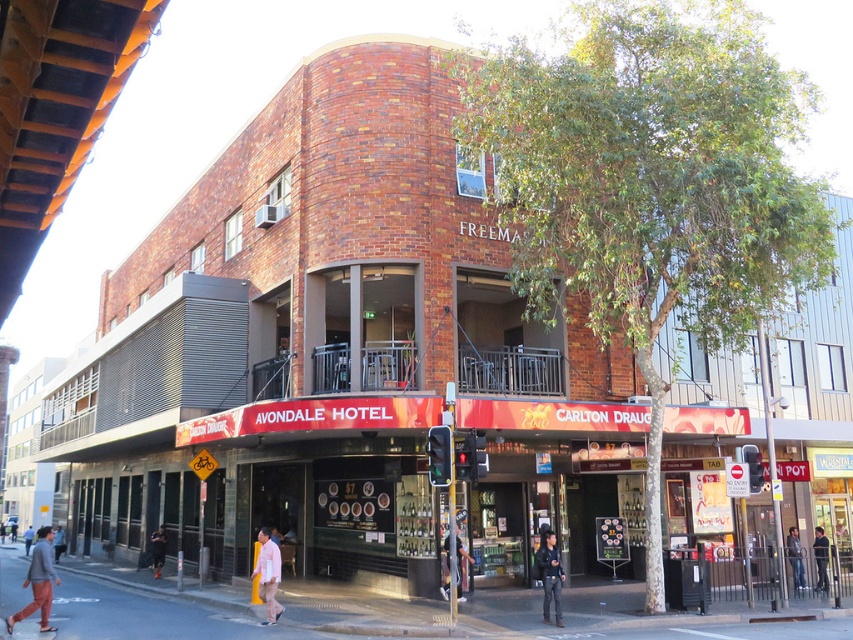
Between point (444, 577) and point (151, 552), which one is positioned behind?

The point (151, 552) is behind.

Is the position of light blue jeans at lower center more distant than that of dark gray pants at lower left?

No, it is not.

What do you see at coordinates (460, 566) in the screenshot? The width and height of the screenshot is (853, 640). I see `light blue jeans at lower center` at bounding box center [460, 566].

Where is `light blue jeans at lower center`? This screenshot has width=853, height=640. light blue jeans at lower center is located at coordinates (460, 566).

Can you confirm if denim jacket at lower right is positioned below light pink shirt at lower center?

No, denim jacket at lower right is not below light pink shirt at lower center.

Between denim jacket at lower right and light pink shirt at lower center, which one appears on the right side from the viewer's perspective?

denim jacket at lower right

Is point (801, 579) more distant than point (25, 531)?

No, it is not.

I want to click on denim jacket at lower right, so click(x=795, y=557).

Can you confirm if dark gray pants at lower left is positioned to the right of light pink shirt at lower center?

Indeed, dark gray pants at lower left is positioned on the right side of light pink shirt at lower center.

Is dark gray pants at lower left below light pink shirt at lower center?

Incorrect, dark gray pants at lower left is not positioned below light pink shirt at lower center.

Is point (161, 564) farther from viewer compared to point (26, 552)?

No, (161, 564) is closer to viewer.

Locate an element on the screen. dark gray pants at lower left is located at coordinates (158, 548).